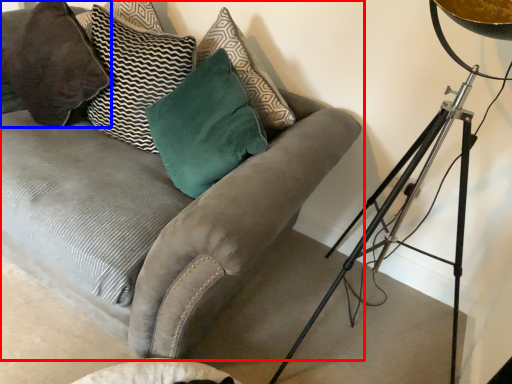
Question: Among these objects, which one is farthest to the camera, studio couch (highlighted by a red box) or pillow (highlighted by a blue box)?

Choices:
 (A) studio couch
 (B) pillow

Answer: (B)